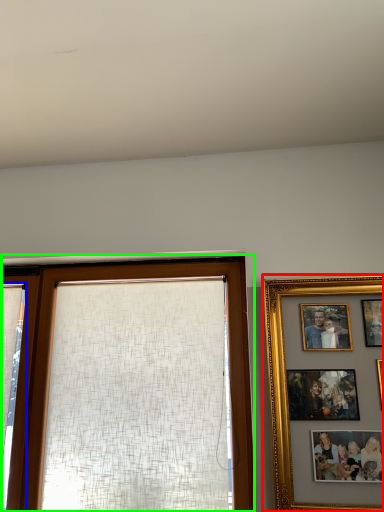
Question: Which is nearer to the picture frame (highlighted by a red box)? curtain (highlighted by a blue box) or window (highlighted by a green box).

Choices:
 (A) curtain
 (B) window

Answer: (B)